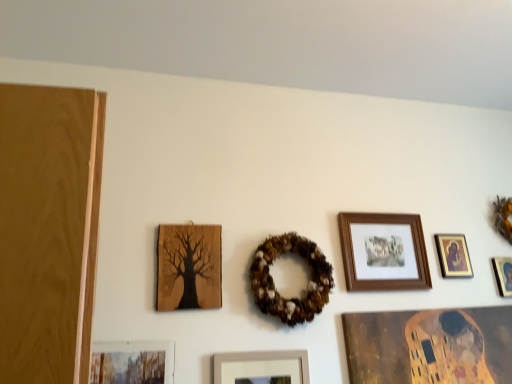
Image resolution: width=512 pixels, height=384 pixels. Find the location of `matte wooden frame at lower left, which is counted as the sixth picture frame, starting from the right`. matte wooden frame at lower left, which is counted as the sixth picture frame, starting from the right is located at coordinates (132, 362).

At what (x,y) coordinates should I click in order to perform the action: click on matte black picture frame at upper right, the 1th picture frame positioned from the right. Please return your answer as a coordinate pair (x, y). The image size is (512, 384). Looking at the image, I should click on (503, 275).

Does wooden framed photo at center right, positioned as the 4th picture frame in left-to-right order, have a greater height compared to brown textured wreath at center, which is the second decor in back-to-front order?

No, wooden framed photo at center right, positioned as the 4th picture frame in left-to-right order, is not taller than brown textured wreath at center, which is the second decor in back-to-front order.

Considering the sizes of objects wooden framed photo at center right, positioned as the 4th picture frame in left-to-right order, and brown textured wreath at center, which is the 1th decor from front to back, in the image provided, who is thinner, wooden framed photo at center right, positioned as the 4th picture frame in left-to-right order, or brown textured wreath at center, which is the 1th decor from front to back,?

Result: wooden framed photo at center right, positioned as the 4th picture frame in left-to-right order, is thinner.

From the image's perspective, between wooden framed photo at center right, positioned as the 4th picture frame in left-to-right order, and brown textured wreath at center, which is counted as the second decor, starting from the right, who is located below?

brown textured wreath at center, which is counted as the second decor, starting from the right, from the image's perspective.

In the image, is wooden framed photo at center right, the third picture frame when ordered from right to left, positioned in front of or behind brown textured wreath at center, the 1th decor viewed from the left?

wooden framed photo at center right, the third picture frame when ordered from right to left, is behind brown textured wreath at center, the 1th decor viewed from the left.

Does orange fabric wreath at upper right, which is the 1th decor in right-to-left order, have a greater width compared to wooden tree silhouette at left, arranged as the fifth picture frame when viewed from the right?

Indeed, orange fabric wreath at upper right, which is the 1th decor in right-to-left order, has a greater width compared to wooden tree silhouette at left, arranged as the fifth picture frame when viewed from the right.

Do you think orange fabric wreath at upper right, which appears as the first decor when viewed from the back, is within wooden tree silhouette at left, arranged as the fifth picture frame when viewed from the right, or outside of it?

The correct answer is: outside.

Between orange fabric wreath at upper right, which is counted as the 2th decor, starting from the front, and wooden tree silhouette at left, which is the 2th picture frame from left to right, which one is positioned behind?

orange fabric wreath at upper right, which is counted as the 2th decor, starting from the front.

Visually, is orange fabric wreath at upper right, which is the 1th decor in right-to-left order, positioned to the left or to the right of wooden tree silhouette at left, which is the 2th picture frame from left to right?

Based on their positions, orange fabric wreath at upper right, which is the 1th decor in right-to-left order, is located to the right of wooden tree silhouette at left, which is the 2th picture frame from left to right.

Is brown textured wreath at center, which is the second decor in back-to-front order, positioned far away from wooden tree silhouette at left, arranged as the fifth picture frame when viewed from the right?

Actually, brown textured wreath at center, which is the second decor in back-to-front order, and wooden tree silhouette at left, arranged as the fifth picture frame when viewed from the right, are a little close together.

Could you tell me if brown textured wreath at center, which is the second decor in back-to-front order, is facing wooden tree silhouette at left, arranged as the fifth picture frame when viewed from the right?

No, brown textured wreath at center, which is the second decor in back-to-front order, is not oriented towards wooden tree silhouette at left, arranged as the fifth picture frame when viewed from the right.

Is wooden tree silhouette at left, which is the 2th picture frame from left to right, completely or partially inside brown textured wreath at center, which is the 1th decor from front to back?

Definitely not — wooden tree silhouette at left, which is the 2th picture frame from left to right, is not inside brown textured wreath at center, which is the 1th decor from front to back.

Can brown textured wreath at center, which is counted as the second decor, starting from the right, be found inside matte wooden frame at lower left, which is counted as the sixth picture frame, starting from the right?

No, brown textured wreath at center, which is counted as the second decor, starting from the right, is located outside of matte wooden frame at lower left, which is counted as the sixth picture frame, starting from the right.

How many degrees apart are the facing directions of matte wooden frame at lower left, marked as the first picture frame in a left-to-right arrangement, and brown textured wreath at center, which is counted as the second decor, starting from the right?

0.0026 degrees separate the facing orientations of matte wooden frame at lower left, marked as the first picture frame in a left-to-right arrangement, and brown textured wreath at center, which is counted as the second decor, starting from the right.

From a real-world perspective, is matte wooden frame at lower left, marked as the first picture frame in a left-to-right arrangement, under brown textured wreath at center, which is the second decor in back-to-front order?

Correct, in the physical world, matte wooden frame at lower left, marked as the first picture frame in a left-to-right arrangement, is lower than brown textured wreath at center, which is the second decor in back-to-front order.

Is wooden tree silhouette at left, arranged as the fifth picture frame when viewed from the right, aimed at wooden framed photo at center right, positioned as the 4th picture frame in left-to-right order?

No, wooden tree silhouette at left, arranged as the fifth picture frame when viewed from the right, is not turned towards wooden framed photo at center right, positioned as the 4th picture frame in left-to-right order.

Is wooden tree silhouette at left, arranged as the fifth picture frame when viewed from the right, next to wooden framed photo at center right, positioned as the 4th picture frame in left-to-right order?

There is a gap between wooden tree silhouette at left, arranged as the fifth picture frame when viewed from the right, and wooden framed photo at center right, positioned as the 4th picture frame in left-to-right order.

You are a GUI agent. You are given a task and a screenshot of the screen. Output one action in this format:
    pyautogui.click(x=<x>, y=<y>)
    Task: Click on the 2nd picture frame below the wooden framed photo at center right, the third picture frame when ordered from right to left (from a real-world perspective)
    
    Given the screenshot: What is the action you would take?
    pyautogui.click(x=189, y=267)

Relative to wooden framed photo at center right, the third picture frame when ordered from right to left, is wooden tree silhouette at left, which is the 2th picture frame from left to right, in front or behind?

Visually, wooden tree silhouette at left, which is the 2th picture frame from left to right, is located in front of wooden framed photo at center right, the third picture frame when ordered from right to left.

Is the position of matte black picture frame at upper right, the 6th picture frame from the left, more distant than that of wooden tree silhouette at left, arranged as the fifth picture frame when viewed from the right?

That is True.

How different are the orientations of matte black picture frame at upper right, the 1th picture frame positioned from the right, and wooden tree silhouette at left, arranged as the fifth picture frame when viewed from the right, in degrees?

0.00355 degrees.

Does point (507, 264) appear closer or farther from the camera than point (196, 291)?

Point (507, 264).

Can you tell me how much gold-framed picture at upper right, the fifth picture frame from the left, and matte white picture frame at center, which appears as the 4th picture frame when viewed from the right, differ in facing direction?

0.00347 degrees separate the facing orientations of gold-framed picture at upper right, the fifth picture frame from the left, and matte white picture frame at center, which appears as the 4th picture frame when viewed from the right.

Does point (450, 265) appear closer or farther from the camera than point (240, 373)?

Point (450, 265) appears to be farther away from the viewer than point (240, 373).

Considering the relative sizes of gold-framed picture at upper right, the 2th picture frame viewed from the right, and matte white picture frame at center, which is the 3th picture frame from left to right, in the image provided, is gold-framed picture at upper right, the 2th picture frame viewed from the right, smaller than matte white picture frame at center, which is the 3th picture frame from left to right,?

Yes, gold-framed picture at upper right, the 2th picture frame viewed from the right, is smaller than matte white picture frame at center, which is the 3th picture frame from left to right.

From a real-world perspective, which is physically below, gold-framed picture at upper right, the 2th picture frame viewed from the right, or matte white picture frame at center, which is the 3th picture frame from left to right?

In real-world perspective, matte white picture frame at center, which is the 3th picture frame from left to right, is lower.

The width and height of the screenshot is (512, 384). Find the location of `decor that appears below the wooden framed photo at center right, positioned as the 4th picture frame in left-to-right order (from the image's perspective)`. decor that appears below the wooden framed photo at center right, positioned as the 4th picture frame in left-to-right order (from the image's perspective) is located at coordinates (274, 284).

Locate an element on the screen. the 5th picture frame to the left of the orange fabric wreath at upper right, which is counted as the 2th decor, starting from the front, counting from the anchor's position is located at coordinates (189, 267).

From the image, which object appears to be nearer to matte white picture frame at center, which is the 3th picture frame from left to right, matte wooden frame at lower left, marked as the first picture frame in a left-to-right arrangement, or matte black picture frame at upper right, the 1th picture frame positioned from the right?

matte wooden frame at lower left, marked as the first picture frame in a left-to-right arrangement, is positioned closer to the anchor matte white picture frame at center, which is the 3th picture frame from left to right.

Looking at this image, considering their positions, is gold-framed picture at upper right, the fifth picture frame from the left, positioned closer to wooden framed photo at center right, the third picture frame when ordered from right to left, than brown textured wreath at center, which is the 1th decor from front to back?

Based on the image, gold-framed picture at upper right, the fifth picture frame from the left, appears to be nearer to wooden framed photo at center right, the third picture frame when ordered from right to left.

Based on their spatial positions, is matte white picture frame at center, which appears as the 4th picture frame when viewed from the right, or wooden tree silhouette at left, which is the 2th picture frame from left to right, further from orange fabric wreath at upper right, which appears as the first decor when viewed from the back?

wooden tree silhouette at left, which is the 2th picture frame from left to right.

Which object lies nearer to the anchor point matte black picture frame at upper right, the 6th picture frame from the left, orange fabric wreath at upper right, which appears as the first decor when viewed from the back, or matte wooden frame at lower left, marked as the first picture frame in a left-to-right arrangement?

orange fabric wreath at upper right, which appears as the first decor when viewed from the back.

Considering their positions, is matte wooden frame at lower left, which is counted as the sixth picture frame, starting from the right, positioned closer to brown textured wreath at center, the 1th decor viewed from the left, than matte black picture frame at upper right, the 1th picture frame positioned from the right?

matte wooden frame at lower left, which is counted as the sixth picture frame, starting from the right, lies closer to brown textured wreath at center, the 1th decor viewed from the left, than the other object.

Considering their positions, is orange fabric wreath at upper right, which is counted as the 2th decor, starting from the front, positioned closer to matte wooden frame at lower left, which is counted as the sixth picture frame, starting from the right, than brown textured wreath at center, which is the second decor in back-to-front order?

brown textured wreath at center, which is the second decor in back-to-front order, is positioned closer to the anchor matte wooden frame at lower left, which is counted as the sixth picture frame, starting from the right.

Based on their spatial positions, is brown textured wreath at center, which is the second decor in back-to-front order, or orange fabric wreath at upper right, which is counted as the 2th decor, starting from the front, closer to matte black picture frame at upper right, the 6th picture frame from the left?

orange fabric wreath at upper right, which is counted as the 2th decor, starting from the front, lies closer to matte black picture frame at upper right, the 6th picture frame from the left, than the other object.

Based on the photo, when comparing their distances from matte white picture frame at center, which appears as the 4th picture frame when viewed from the right, does orange fabric wreath at upper right, which appears as the 2th decor when viewed from the left, or matte black picture frame at upper right, the 6th picture frame from the left, seem closer?

matte black picture frame at upper right, the 6th picture frame from the left, lies closer to matte white picture frame at center, which appears as the 4th picture frame when viewed from the right, than the other object.

Identify the location of picture frame between wooden tree silhouette at left, which is the 2th picture frame from left to right, and wooden framed photo at center right, the third picture frame when ordered from right to left. This screenshot has width=512, height=384. (262, 367).

The height and width of the screenshot is (384, 512). In order to click on decor between wooden tree silhouette at left, which is the 2th picture frame from left to right, and matte black picture frame at upper right, the 6th picture frame from the left in this screenshot , I will do `click(274, 284)`.

The image size is (512, 384). I want to click on decor between wooden tree silhouette at left, which is the 2th picture frame from left to right, and matte white picture frame at center, which appears as the 4th picture frame when viewed from the right, in the vertical direction, so click(x=274, y=284).

Where is `decor between matte wooden frame at lower left, which is counted as the sixth picture frame, starting from the right, and orange fabric wreath at upper right, which is the 1th decor in right-to-left order, from left to right`? This screenshot has height=384, width=512. decor between matte wooden frame at lower left, which is counted as the sixth picture frame, starting from the right, and orange fabric wreath at upper right, which is the 1th decor in right-to-left order, from left to right is located at coordinates (274, 284).